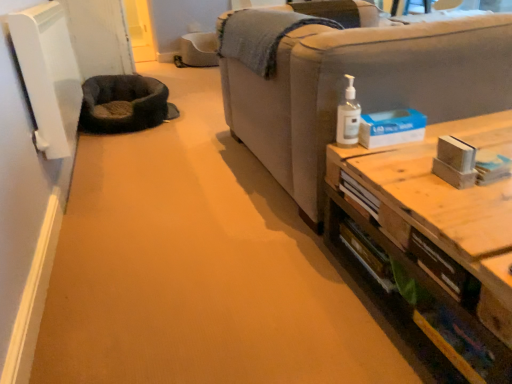
Question: Does dark gray plush cat bed at left lie behind wooden table at right?

Choices:
 (A) no
 (B) yes

Answer: (B)

Question: Is dark gray plush cat bed at left oriented away from wooden table at right?

Choices:
 (A) yes
 (B) no

Answer: (B)

Question: Does dark gray plush cat bed at left have a lesser width compared to wooden table at right?

Choices:
 (A) no
 (B) yes

Answer: (B)

Question: Does dark gray plush cat bed at left contain wooden table at right?

Choices:
 (A) yes
 (B) no

Answer: (B)

Question: Does dark gray plush cat bed at left have a smaller size compared to wooden table at right?

Choices:
 (A) no
 (B) yes

Answer: (B)

Question: Is dark gray plush cat bed at left spatially inside clear plastic pump bottle at upper right, or outside of it?

Choices:
 (A) outside
 (B) inside

Answer: (A)

Question: Is dark gray plush cat bed at left bigger or smaller than clear plastic pump bottle at upper right?

Choices:
 (A) small
 (B) big

Answer: (B)

Question: Is dark gray plush cat bed at left in front of or behind clear plastic pump bottle at upper right in the image?

Choices:
 (A) behind
 (B) front

Answer: (A)

Question: From the image's perspective, is dark gray plush cat bed at left positioned above or below clear plastic pump bottle at upper right?

Choices:
 (A) above
 (B) below

Answer: (A)

Question: From the image's perspective, is wooden table at right located above or below light gray fabric couch at right?

Choices:
 (A) above
 (B) below

Answer: (B)

Question: Is wooden table at right bigger or smaller than light gray fabric couch at right?

Choices:
 (A) small
 (B) big

Answer: (A)

Question: Visually, is wooden table at right positioned to the left or to the right of light gray fabric couch at right?

Choices:
 (A) right
 (B) left

Answer: (A)

Question: Is wooden table at right wider or thinner than light gray fabric couch at right?

Choices:
 (A) thin
 (B) wide

Answer: (A)

Question: Considering the relative positions of wooden table at right and clear plastic pump bottle at upper right in the image provided, is wooden table at right to the left or to the right of clear plastic pump bottle at upper right?

Choices:
 (A) right
 (B) left

Answer: (A)

Question: Which is correct: wooden table at right is inside clear plastic pump bottle at upper right, or outside of it?

Choices:
 (A) outside
 (B) inside

Answer: (A)